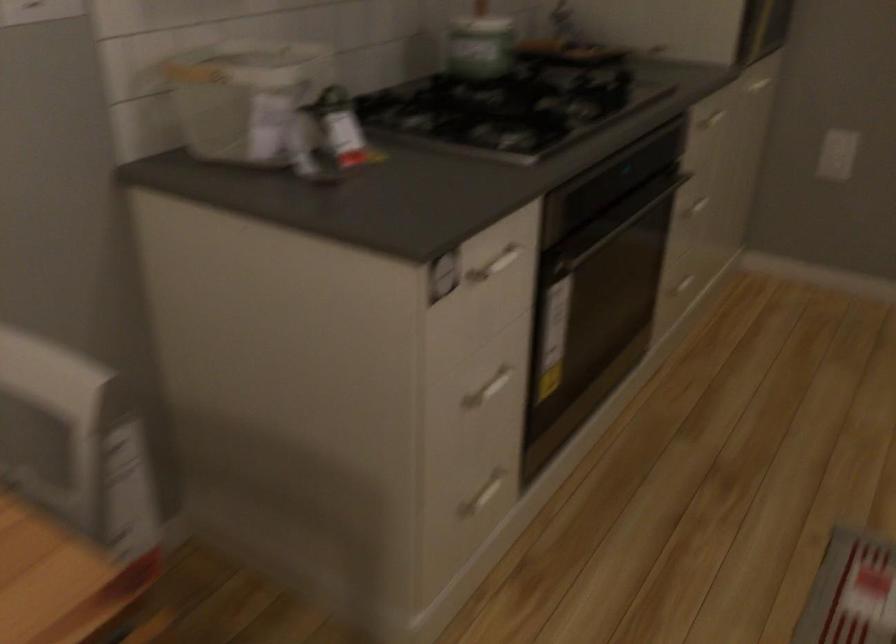
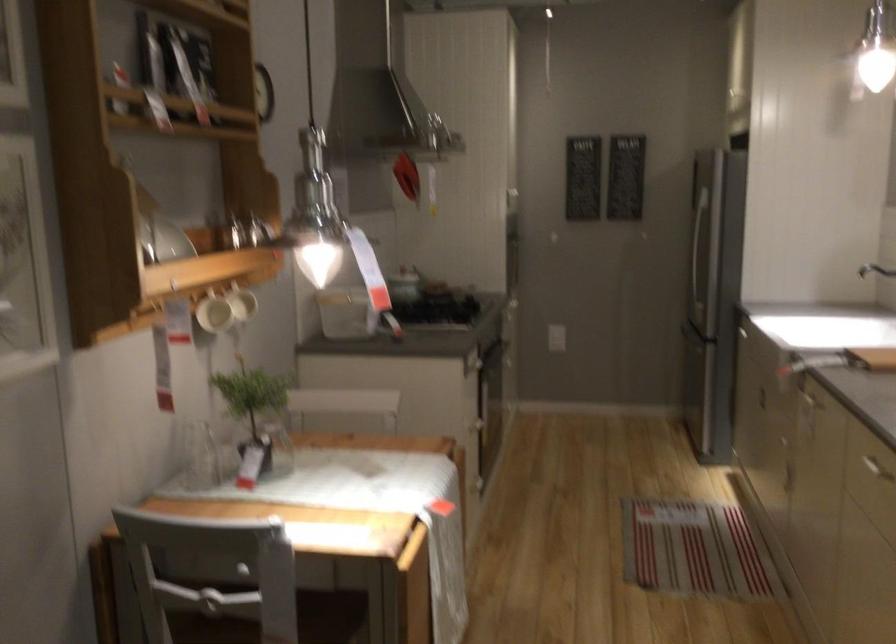
Question: I am providing you with two images of the same scene from different viewpoints. Which of the following objects are not visible in image2?

Choices:
 (A) white drawer handle
 (B) oven door handle
 (C) cabinet drawer handle
 (D) black phone receiver

Answer: (A)